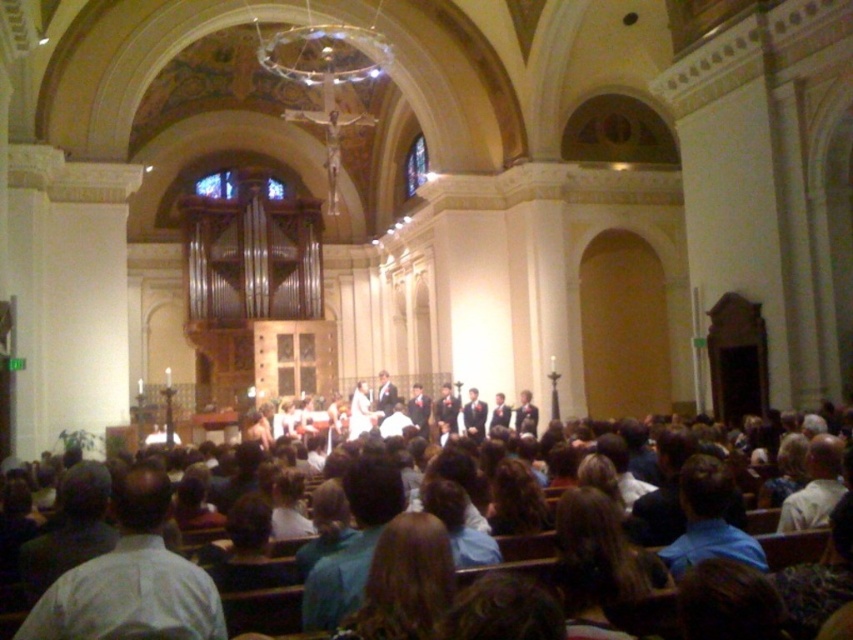
Question: Based on their relative distances, which object is farther from the blue shirt at lower right?

Choices:
 (A) light brown wooden pews at center
 (B) light blue shirt at lower left

Answer: (B)

Question: Is the position of light brown wooden pews at center more distant than that of light blue shirt at lower left?

Choices:
 (A) no
 (B) yes

Answer: (A)

Question: Is light blue shirt at lower left further to camera compared to blue shirt at lower right?

Choices:
 (A) yes
 (B) no

Answer: (B)

Question: Among these objects, which one is nearest to the camera?

Choices:
 (A) blue shirt at lower right
 (B) light blue shirt at lower left
 (C) light brown wooden pews at center

Answer: (C)

Question: Is light brown wooden pews at center further to camera compared to blue shirt at lower right?

Choices:
 (A) yes
 (B) no

Answer: (B)

Question: Which of these objects is positioned farthest from the light blue shirt at lower left?

Choices:
 (A) light brown wooden pews at center
 (B) blue shirt at lower right

Answer: (B)